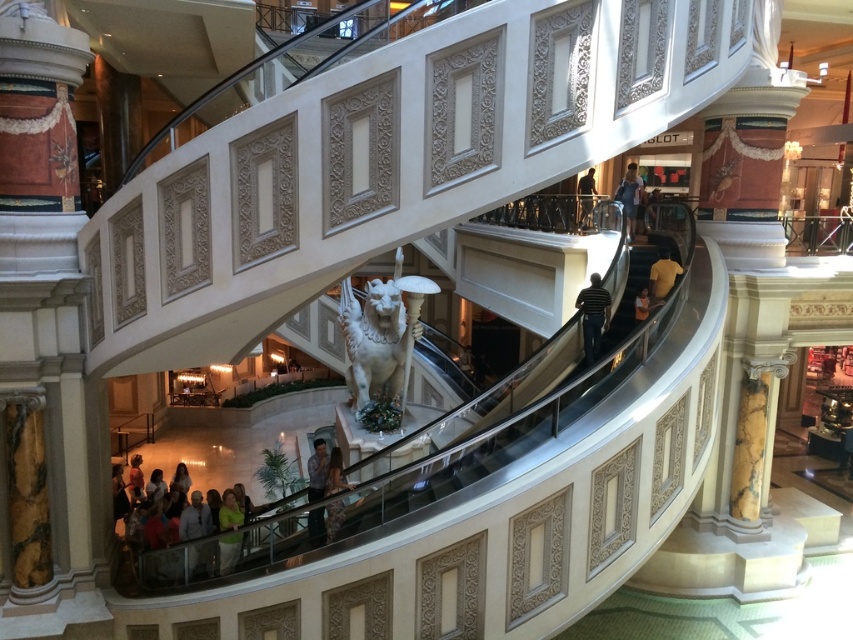
You are a customer in the mall and want to take a photo of both the white marble statue at center and the striped polo shirt at center. Since you can only focus on one object at a time, which one should you focus on first to ensure it appears sharp in the photo?

You should focus on the white marble statue at center first because it is closer to you than the striped polo shirt at center, so focusing on it will keep it sharp while the background object may be slightly blurred.

You are a customer in a luxury boutique and see the light green fabric at lower center and the matte black dress at lower center. Which item is positioned to the left side of the other?

The light green fabric at lower center is positioned to the left of the matte black dress at lower center.

You are a security guard in the mall and need to move a striped polo shirt at center to the lost and found. The path to the lost and found is blocked by the white marble statue at center. Can you move the striped polo shirt around the statue without bending it?

The white marble statue at center might be wider than striped polo shirt at center, so it is possible that the statue is wider, which could block the path. However, since the exact width difference isn not specified, you should assess the space around the statue to ensure there is enough room to maneuver the striped polo shirt without bending it.